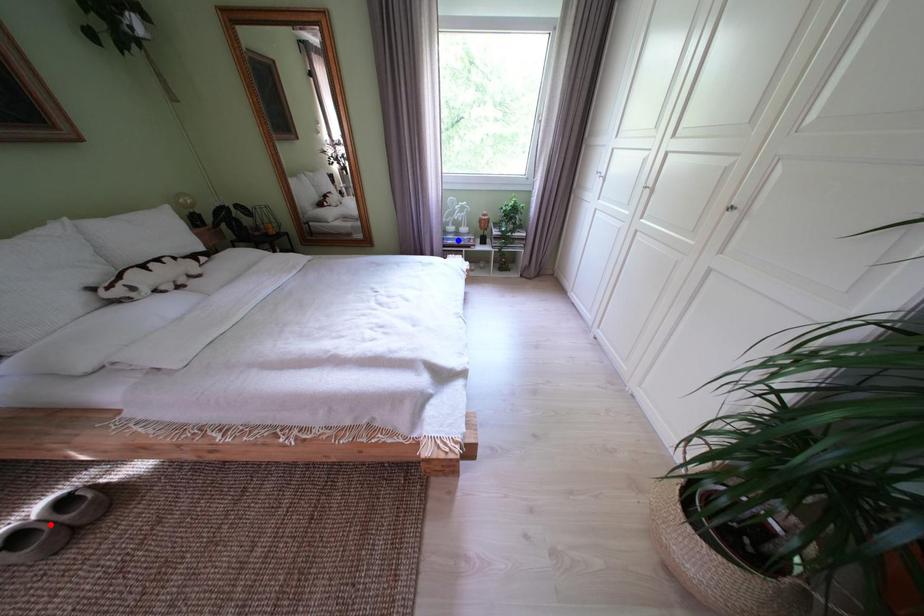
Question: Two points are marked on the image. Which point is closer to the camera?

Choices:
 (A) Blue point is closer.
 (B) Red point is closer.

Answer: (B)